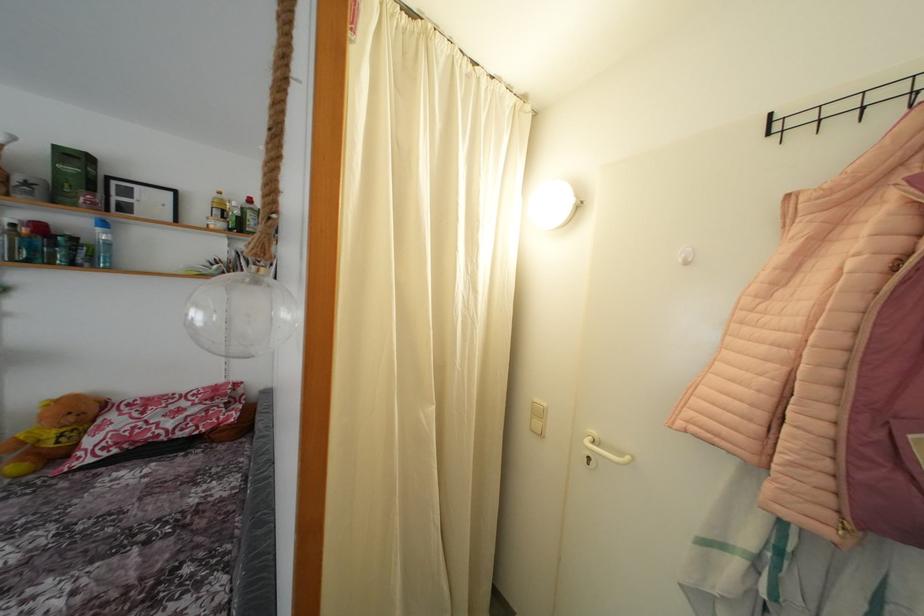
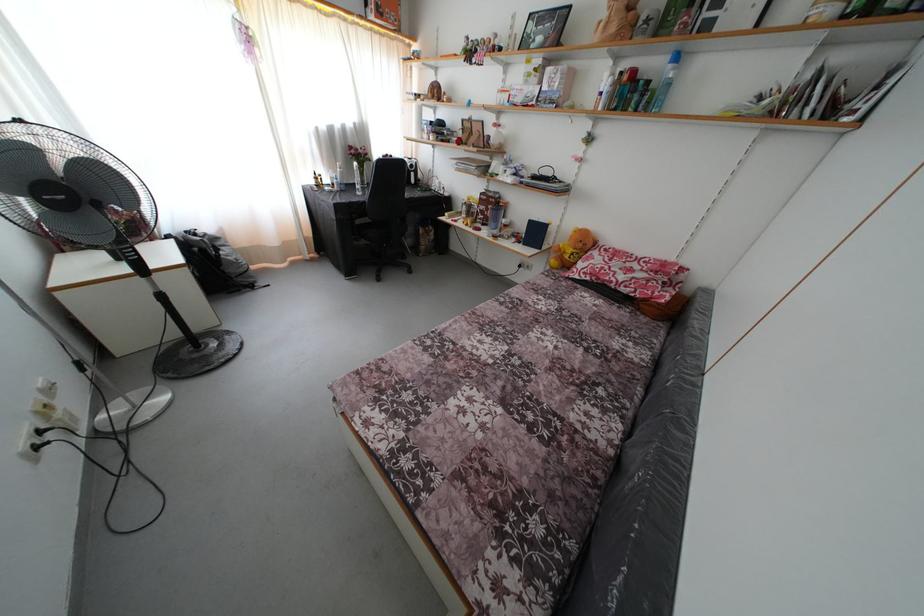
Locate, in the second image, the point that corresponds to point (104, 236) in the first image.

(675, 73)